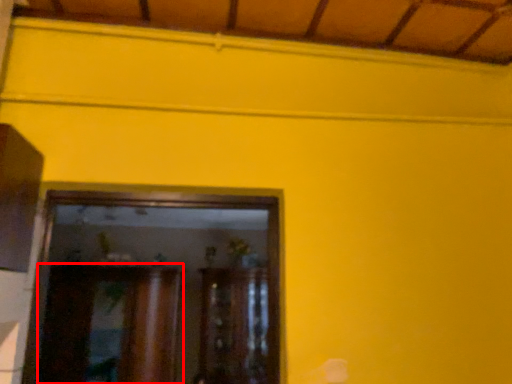
Question: Considering the relative positions of cabinetry (annotated by the red box) and cabinetry in the image provided, where is cabinetry (annotated by the red box) located with respect to the staircase?

Choices:
 (A) left
 (B) right

Answer: (A)